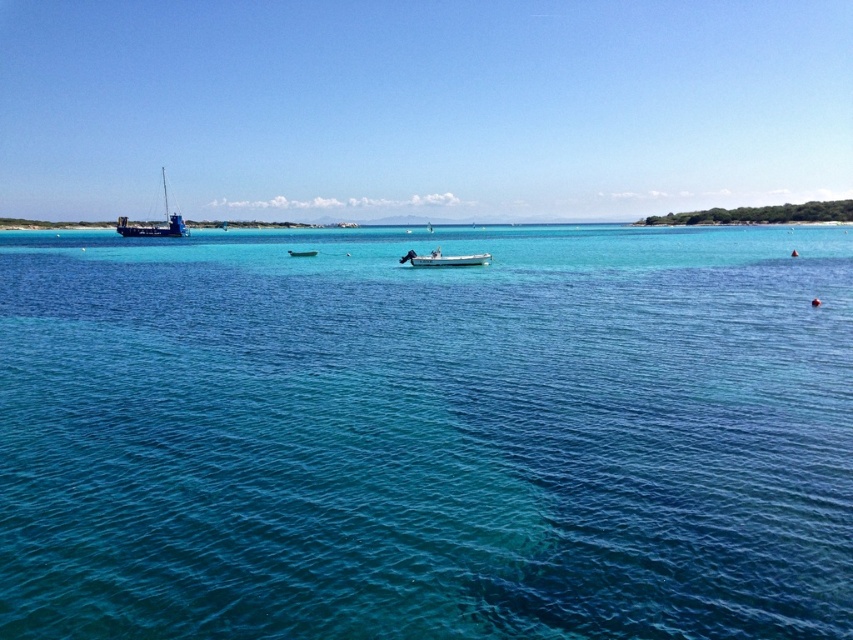
Describe the element at coordinates (426, 433) in the screenshot. I see `clear blue water at center` at that location.

Who is lower down, clear blue water at center or white plastic boat at center?

white plastic boat at center

Between point (384, 561) and point (457, 264), which one is positioned behind?

Positioned behind is point (457, 264).

Locate an element on the screen. The width and height of the screenshot is (853, 640). clear blue water at center is located at coordinates (426, 433).

Is point (125, 230) less distant than point (311, 252)?

No, (125, 230) is further to viewer.

Who is more distant from viewer, (173, 227) or (294, 253)?

The point (173, 227) is behind.

The width and height of the screenshot is (853, 640). I want to click on metallic blue boat at left, so click(x=154, y=225).

From the picture: Which is more to the right, clear blue water at center or metallic blue boat at left?

clear blue water at center is more to the right.

Measure the distance from clear blue water at center to metallic blue boat at left.

A distance of 91.34 meters exists between clear blue water at center and metallic blue boat at left.

Is point (73, 557) more distant than point (167, 211)?

No, (73, 557) is closer to viewer.

This screenshot has height=640, width=853. I want to click on clear blue water at center, so click(x=426, y=433).